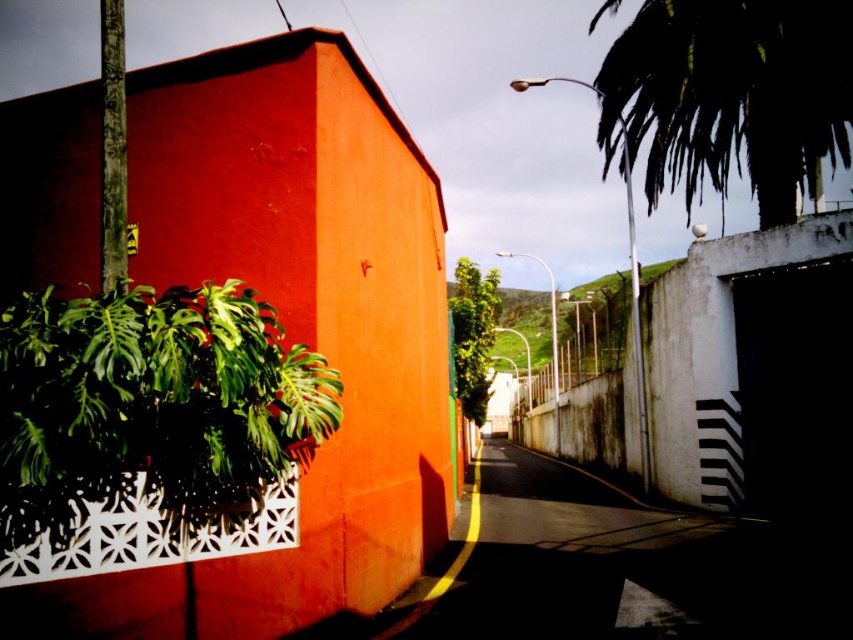
Question: Is green leafy plant at left below dark asphalt at center?

Choices:
 (A) yes
 (B) no

Answer: (B)

Question: Which of the following is the closest to the observer?

Choices:
 (A) (619, 604)
 (B) (155, 412)

Answer: (B)

Question: Which object appears farthest from the camera in this image?

Choices:
 (A) dark asphalt at center
 (B) green leafy plant at left

Answer: (A)

Question: Which point is farther from the camera taking this photo?

Choices:
 (A) coord(323,406)
 (B) coord(471,538)

Answer: (B)

Question: Can you confirm if green leafy plant at left is positioned below dark asphalt at center?

Choices:
 (A) no
 (B) yes

Answer: (A)

Question: Can you confirm if green leafy plant at left is bigger than dark asphalt at center?

Choices:
 (A) yes
 (B) no

Answer: (B)